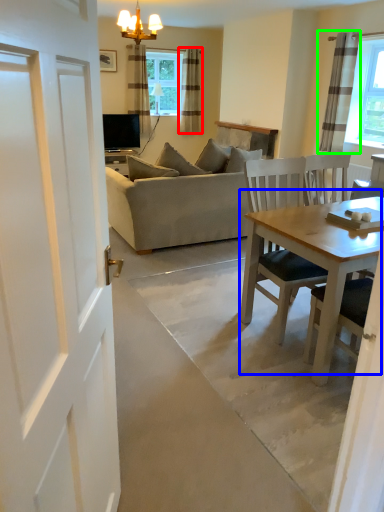
Question: Which object is positioned closest to curtain (highlighted by a red box)? Select from table (highlighted by a blue box) and curtain (highlighted by a green box).

Choices:
 (A) table
 (B) curtain

Answer: (B)